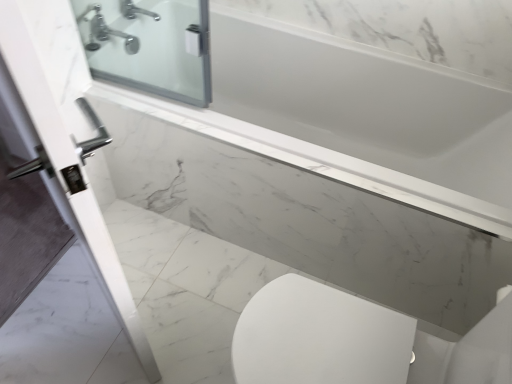
Locate an element on the screen. vacant area on the back side of white glossy door handle at left is located at coordinates (144, 248).